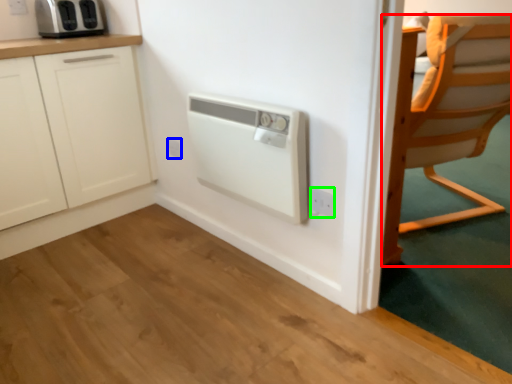
Question: Which object is the farthest from chair (highlighted by a red box)? Choose among these: electric outlet (highlighted by a blue box) or electric outlet (highlighted by a green box).

Choices:
 (A) electric outlet
 (B) electric outlet

Answer: (A)